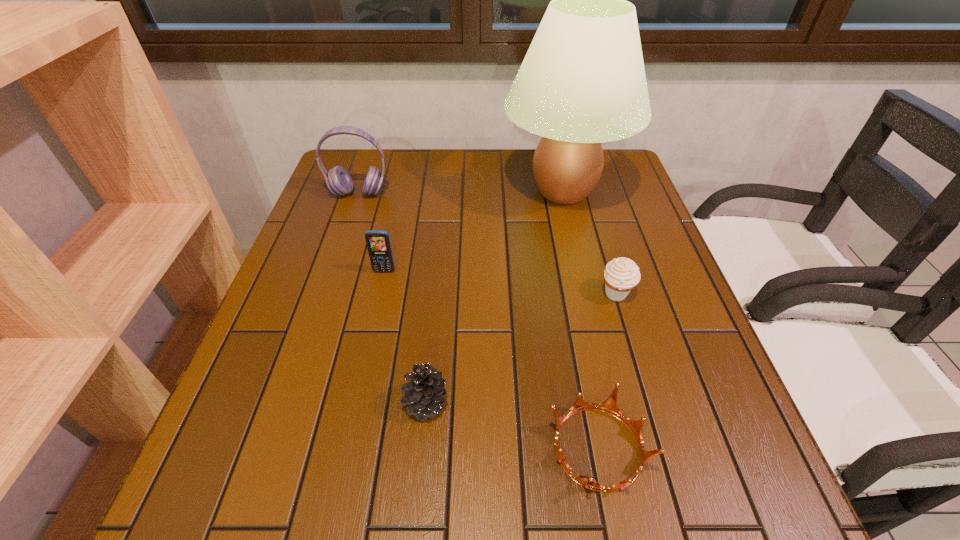
Locate an element on the screen. The height and width of the screenshot is (540, 960). free spot that satisfies the following two spatial constraints: 1. on the screen of the cellular telephone; 2. on the left side of the third object from left to right is located at coordinates (355, 403).